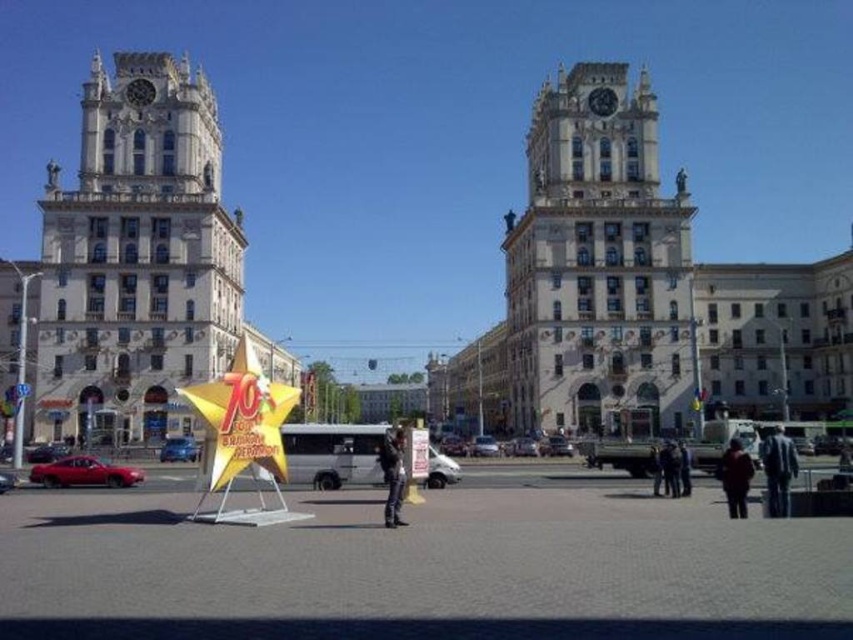
You are standing in the urban scene and want to take a photo of both the white stone clock tower at left and the dark brown leather jacket at lower right. Which object will appear wider in the photo?

The white stone clock tower at left will appear wider in the photo because its width surpasses that of the dark brown leather jacket at lower right.

You are a tourist standing in front of the white stone clock tower at left and the dark brown leather jacket at lower right. Which object is closer to you?

The white stone clock tower at left is closer to you since it is further to the viewer than the dark brown leather jacket at lower right.